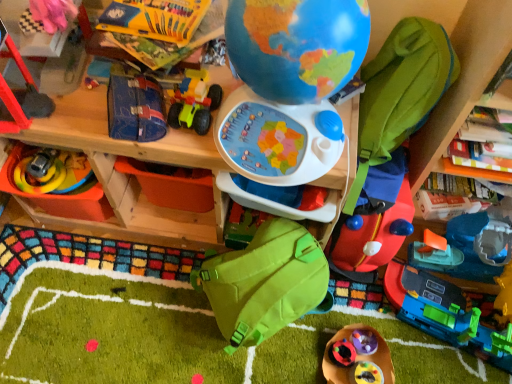
Question: Is wooden table at center outside of rubberized plastic toy at lower center, the 3th toy viewed from the right?

Choices:
 (A) no
 (B) yes

Answer: (B)

Question: Is wooden table at center at the right side of rubberized plastic toy at lower center, the 3th toy viewed from the right?

Choices:
 (A) yes
 (B) no

Answer: (B)

Question: Would you say rubberized plastic toy at lower center, the 3th toy viewed from the right, is part of wooden table at center's contents?

Choices:
 (A) yes
 (B) no

Answer: (B)

Question: Is wooden table at center bigger than rubberized plastic toy at lower center, the 3th toy viewed from the right?

Choices:
 (A) yes
 (B) no

Answer: (A)

Question: Is wooden table at center positioned with its back to rubberized plastic toy at lower center, the 3th toy viewed from the right?

Choices:
 (A) no
 (B) yes

Answer: (A)

Question: Considering the positions of wooden table at center and rubberized black toy at lower center, marked as the seventh toy in a left-to-right arrangement, in the image, is wooden table at center taller or shorter than rubberized black toy at lower center, marked as the seventh toy in a left-to-right arrangement,?

Choices:
 (A) short
 (B) tall

Answer: (B)

Question: Is wooden table at center spatially inside rubberized black toy at lower center, which appears as the 5th toy when viewed from the right, or outside of it?

Choices:
 (A) outside
 (B) inside

Answer: (A)

Question: In terms of size, does wooden table at center appear bigger or smaller than rubberized black toy at lower center, marked as the seventh toy in a left-to-right arrangement?

Choices:
 (A) big
 (B) small

Answer: (A)

Question: Looking at their shapes, would you say wooden table at center is wider or thinner than rubberized black toy at lower center, marked as the seventh toy in a left-to-right arrangement?

Choices:
 (A) thin
 (B) wide

Answer: (B)

Question: From their relative heights in the image, would you say blue fabric case at center, positioned as the 9th toy in right-to-left order, is taller or shorter than matte plastic crayons at upper left, the eighth toy viewed from the right?

Choices:
 (A) tall
 (B) short

Answer: (A)

Question: From a real-world perspective, is blue fabric case at center, positioned as the 9th toy in right-to-left order, positioned above or below matte plastic crayons at upper left, which ranks as the fourth toy in left-to-right order?

Choices:
 (A) below
 (B) above

Answer: (A)

Question: In terms of size, does blue fabric case at center, positioned as the 9th toy in right-to-left order, appear bigger or smaller than matte plastic crayons at upper left, the eighth toy viewed from the right?

Choices:
 (A) big
 (B) small

Answer: (A)

Question: Considering the positions of blue fabric case at center, which ranks as the 3th toy in left-to-right order, and matte plastic crayons at upper left, which ranks as the fourth toy in left-to-right order, in the image, is blue fabric case at center, which ranks as the 3th toy in left-to-right order, wider or thinner than matte plastic crayons at upper left, which ranks as the fourth toy in left-to-right order,?

Choices:
 (A) wide
 (B) thin

Answer: (B)

Question: Looking at their shapes, would you say green fabric backpack at lower center, which appears as the 6th toy when viewed from the left, is wider or thinner than rubberized red ladder at left, which appears as the 10th toy when viewed from the right?

Choices:
 (A) thin
 (B) wide

Answer: (B)

Question: Relative to rubberized red ladder at left, which appears as the 10th toy when viewed from the right, is green fabric backpack at lower center, which appears as the 6th toy when viewed from the left, in front or behind?

Choices:
 (A) behind
 (B) front

Answer: (A)